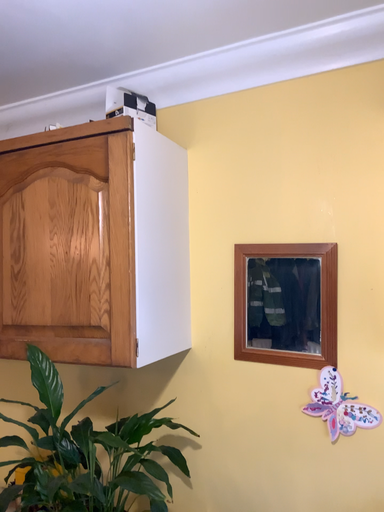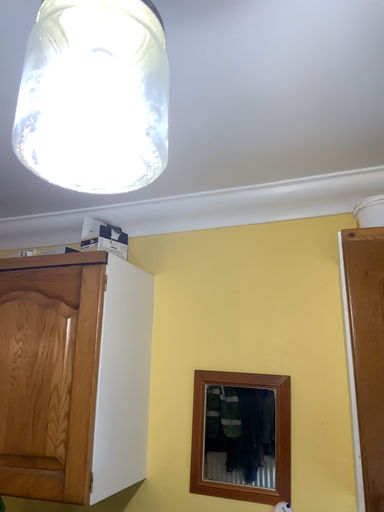
Question: How did the camera likely rotate when shooting the video?

Choices:
 (A) rotated upward
 (B) rotated downward

Answer: (A)